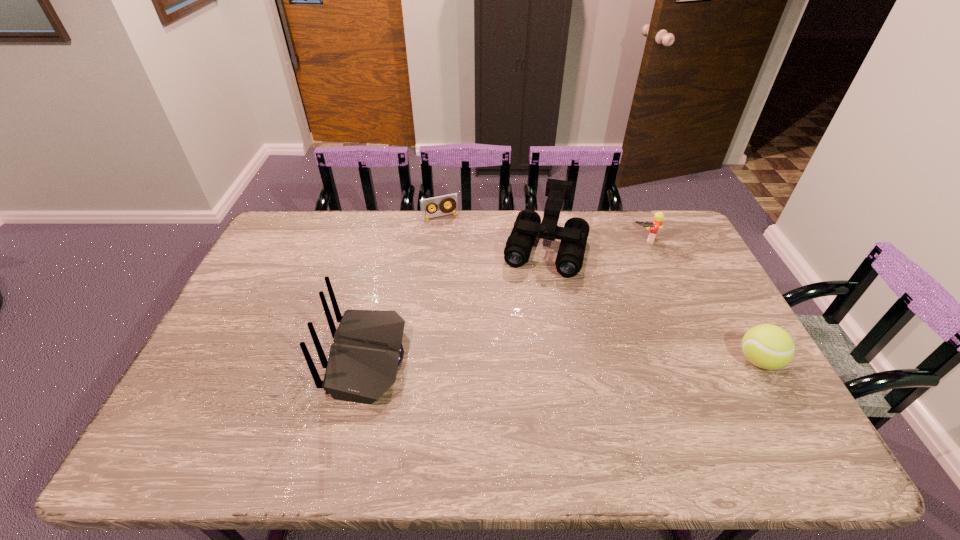
Where is `router`? router is located at coordinates (367, 349).

This screenshot has height=540, width=960. In order to click on the rightmost object in this screenshot , I will do `click(767, 346)`.

Find the location of `the third object from right to left`. the third object from right to left is located at coordinates (528, 225).

At what (x,y) coordinates should I click in order to perform the action: click on Lego. Please return your answer as a coordinate pair (x, y). The image size is (960, 540). Looking at the image, I should click on click(x=658, y=217).

Identify the location of the shortest object. The width and height of the screenshot is (960, 540). (452, 199).

At what (x,y) coordinates should I click in order to perform the action: click on vacant space located 0.130m on the back of the router. Please return your answer as a coordinate pair (x, y). The width and height of the screenshot is (960, 540). Looking at the image, I should click on (282, 359).

Where is `vacant space positioned on the back of the router`? vacant space positioned on the back of the router is located at coordinates (279, 359).

Where is `vacant space positioned 0.100m on the back of the router`? This screenshot has height=540, width=960. vacant space positioned 0.100m on the back of the router is located at coordinates (294, 359).

The width and height of the screenshot is (960, 540). I want to click on free location located on the back of the rightmost object, so click(x=699, y=254).

This screenshot has width=960, height=540. Identify the location of free location located on the front lenses of the third object from left to right. coord(514,366).